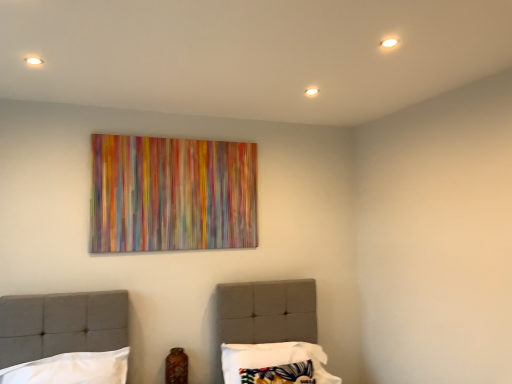
Question: Which direction should I rotate to look at patterned fabric pillow at center, the second pillow when ordered from left to right, — up or down?

Choices:
 (A) up
 (B) down

Answer: (B)

Question: Is patterned fabric pillow at center, the 1th pillow when ordered from right to left, located within white fabric pillow at lower left, which ranks as the 1th pillow in left-to-right order?

Choices:
 (A) yes
 (B) no

Answer: (B)

Question: Does white fabric pillow at lower left, which is the 2th pillow from right to left, have a smaller size compared to patterned fabric pillow at center, the 1th pillow when ordered from right to left?

Choices:
 (A) no
 (B) yes

Answer: (B)

Question: Can we say white fabric pillow at lower left, which is the 2th pillow from right to left, lies outside patterned fabric pillow at center, the 1th pillow when ordered from right to left?

Choices:
 (A) no
 (B) yes

Answer: (B)

Question: From the image's perspective, is white fabric pillow at lower left, which ranks as the 1th pillow in left-to-right order, on patterned fabric pillow at center, the second pillow when ordered from left to right?

Choices:
 (A) no
 (B) yes

Answer: (B)

Question: Considering the relative sizes of white fabric pillow at lower left, which ranks as the 1th pillow in left-to-right order, and patterned fabric pillow at center, the second pillow when ordered from left to right, in the image provided, is white fabric pillow at lower left, which ranks as the 1th pillow in left-to-right order, bigger than patterned fabric pillow at center, the second pillow when ordered from left to right,?

Choices:
 (A) yes
 (B) no

Answer: (B)

Question: Does white fabric pillow at lower left, which is the 2th pillow from right to left, appear on the right side of patterned fabric pillow at center, the 1th pillow when ordered from right to left?

Choices:
 (A) no
 (B) yes

Answer: (A)

Question: Is the depth of patterned fabric pillow at center, the 1th pillow when ordered from right to left, less than that of white fabric pillow at lower left, which is the 2th pillow from right to left?

Choices:
 (A) yes
 (B) no

Answer: (B)

Question: Is patterned fabric pillow at center, the second pillow when ordered from left to right, to the right of white fabric pillow at lower left, which is the 2th pillow from right to left, from the viewer's perspective?

Choices:
 (A) no
 (B) yes

Answer: (B)

Question: Can you see patterned fabric pillow at center, the 1th pillow when ordered from right to left, touching white fabric pillow at lower left, which is the 2th pillow from right to left?

Choices:
 (A) no
 (B) yes

Answer: (A)

Question: Is patterned fabric pillow at center, the 1th pillow when ordered from right to left, thinner than white fabric pillow at lower left, which ranks as the 1th pillow in left-to-right order?

Choices:
 (A) no
 (B) yes

Answer: (A)

Question: From the image's perspective, is patterned fabric pillow at center, the second pillow when ordered from left to right, beneath white fabric pillow at lower left, which is the 2th pillow from right to left?

Choices:
 (A) yes
 (B) no

Answer: (A)

Question: From a real-world perspective, does patterned fabric pillow at center, the second pillow when ordered from left to right, sit lower than white fabric pillow at lower left, which is the 2th pillow from right to left?

Choices:
 (A) yes
 (B) no

Answer: (A)

Question: Is patterned fabric pillow at center, the 1th pillow when ordered from right to left, to the left or to the right of white fabric pillow at lower left, which is the 2th pillow from right to left, in the image?

Choices:
 (A) left
 (B) right

Answer: (B)